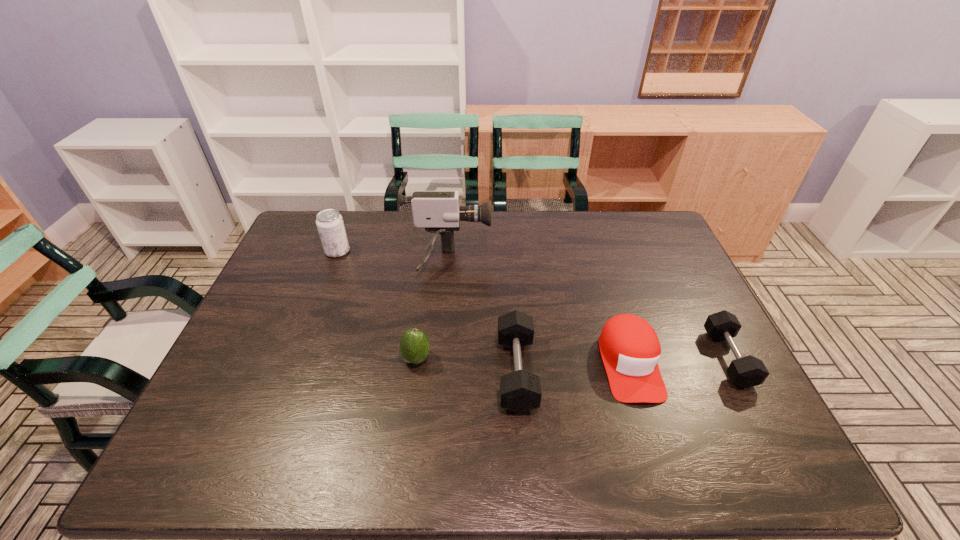
Find the location of `the taller dumbbell`. the taller dumbbell is located at coordinates (520, 391).

Where is `the fourth object from left to right`? This screenshot has height=540, width=960. the fourth object from left to right is located at coordinates (520, 391).

This screenshot has width=960, height=540. What are the coordinates of `the rightmost object` in the screenshot? It's located at (745, 372).

This screenshot has width=960, height=540. In order to click on the right dumbbell in this screenshot , I will do 745,372.

Locate an element on the screen. The width and height of the screenshot is (960, 540). soda can is located at coordinates (330, 224).

Find the location of a particular element. The width and height of the screenshot is (960, 540). the leftmost object is located at coordinates (330, 224).

I want to click on the tallest object, so click(x=438, y=212).

I want to click on avocado, so click(x=414, y=347).

I want to click on baseball cap, so click(630, 349).

Where is `free location located on the left of the taller dumbbell`? free location located on the left of the taller dumbbell is located at coordinates (440, 372).